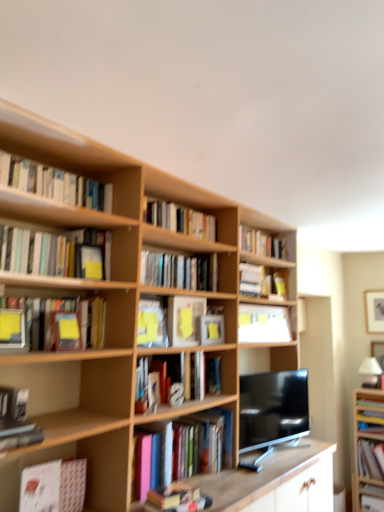
Identify the location of matte pink book at lower left, which is counted as the 4th book, starting from the bottom. (53, 487).

In order to click on yellow matte paper at upper left, which appears as the 2th paperback book when viewed from the front in this screenshot , I will do `click(91, 262)`.

What do you see at coordinates (368, 460) in the screenshot? I see `hardcover book at lower right, the 2th book ordered from the bottom` at bounding box center [368, 460].

The width and height of the screenshot is (384, 512). Identify the location of matte yellow book at left, the 7th book from the top. (64, 324).

Where is `hardcover books at upper left, which is the thirteenth book in bottom-to-top order`? The height and width of the screenshot is (512, 384). hardcover books at upper left, which is the thirteenth book in bottom-to-top order is located at coordinates (54, 183).

Is matte pink book at lower left, the tenth book viewed from the top, looking in the opposite direction of hardcover book at center, which ranks as the 6th book in top-to-bottom order?

No, matte pink book at lower left, the tenth book viewed from the top, is not facing the opposite direction of hardcover book at center, which ranks as the 6th book in top-to-bottom order.

Between matte pink book at lower left, the tenth book viewed from the top, and hardcover book at center, the 8th book in the bottom-to-top sequence, which one appears on the left side from the viewer's perspective?

From the viewer's perspective, matte pink book at lower left, the tenth book viewed from the top, appears more on the left side.

The height and width of the screenshot is (512, 384). I want to click on the 7th book behind when counting from the matte pink book at lower left, which is counted as the 4th book, starting from the bottom, so click(260, 282).

Is matte pink book at lower left, the tenth book viewed from the top, next to hardcover book at center, which ranks as the 6th book in top-to-bottom order, and touching it?

matte pink book at lower left, the tenth book viewed from the top, is not next to hardcover book at center, which ranks as the 6th book in top-to-bottom order, and they're not touching.

Who is bigger, hardcover book at center, which is the 11th book in top-to-bottom order, or matte yellow book at upper left, which appears as the 4th book when viewed from the top?

matte yellow book at upper left, which appears as the 4th book when viewed from the top.

Visually, is hardcover book at center, which is the third book in bottom-to-top order, positioned to the left or to the right of matte yellow book at upper left, which appears as the 4th book when viewed from the top?

hardcover book at center, which is the third book in bottom-to-top order, is to the right of matte yellow book at upper left, which appears as the 4th book when viewed from the top.

Is hardcover book at center, which is the 11th book in top-to-bottom order, closer to camera compared to matte yellow book at upper left, which appears as the 4th book when viewed from the top?

No, hardcover book at center, which is the 11th book in top-to-bottom order, is further to the viewer.

Considering the positions of point (76, 260) and point (262, 234), is point (76, 260) closer or farther from the camera than point (262, 234)?

Clearly, point (76, 260) is closer to the camera than point (262, 234).

Could you tell me if matte yellow book at upper left, which appears as the 4th book when viewed from the top, is facing wooden bookshelf at upper center, the 3th book when ordered from top to bottom?

No, matte yellow book at upper left, which appears as the 4th book when viewed from the top, is not facing towards wooden bookshelf at upper center, the 3th book when ordered from top to bottom.

Can you tell me how much matte yellow book at upper left, the 10th book when ordered from bottom to top, and wooden bookshelf at upper center, which appears as the 11th book when ordered from the bottom, differ in facing direction?

matte yellow book at upper left, the 10th book when ordered from bottom to top, and wooden bookshelf at upper center, which appears as the 11th book when ordered from the bottom, are facing 3.08 degrees away from each other.

From a real-world perspective, is matte yellow book at upper left, the 10th book when ordered from bottom to top, located beneath wooden bookshelf at upper center, the 3th book when ordered from top to bottom?

Yes, from a real-world perspective, matte yellow book at upper left, the 10th book when ordered from bottom to top, is below wooden bookshelf at upper center, the 3th book when ordered from top to bottom.

Who is taller, hardcover book at lower right, the 2th book ordered from the bottom, or yellow matte paper at upper left, which is counted as the 2th paperback book, starting from the left?

With more height is hardcover book at lower right, the 2th book ordered from the bottom.

From the image's perspective, relative to yellow matte paper at upper left, which ranks as the 3th paperback book in right-to-left order, is hardcover book at lower right, the twelfth book positioned from the top, above or below?

Based on their image positions, hardcover book at lower right, the twelfth book positioned from the top, is located beneath yellow matte paper at upper left, which ranks as the 3th paperback book in right-to-left order.

Is yellow matte paper at upper left, which is counted as the 2th paperback book, starting from the left, at the back of hardcover book at lower right, the twelfth book positioned from the top?

That's not correct — hardcover book at lower right, the twelfth book positioned from the top, is not looking away from yellow matte paper at upper left, which is counted as the 2th paperback book, starting from the left.

Can you confirm if hardcover book at lower right, the 2th book ordered from the bottom, is bigger than yellow matte paper at upper left, which ranks as the 3th paperback book in right-to-left order?

Indeed, hardcover book at lower right, the 2th book ordered from the bottom, has a larger size compared to yellow matte paper at upper left, which ranks as the 3th paperback book in right-to-left order.

Considering the relative positions of matte pink book at lower left, which is counted as the 4th book, starting from the bottom, and hardcover books at upper left, placed as the 1th book when sorted from top to bottom, in the image provided, is matte pink book at lower left, which is counted as the 4th book, starting from the bottom, behind hardcover books at upper left, placed as the 1th book when sorted from top to bottom,?

No, matte pink book at lower left, which is counted as the 4th book, starting from the bottom, is closer to the viewer.

Is matte pink book at lower left, which is counted as the 4th book, starting from the bottom, aimed at hardcover books at upper left, which is the thirteenth book in bottom-to-top order?

No.

From their relative heights in the image, would you say matte pink book at lower left, the tenth book viewed from the top, is taller or shorter than hardcover books at upper left, placed as the 1th book when sorted from top to bottom?

Considering their sizes, matte pink book at lower left, the tenth book viewed from the top, has more height than hardcover books at upper left, placed as the 1th book when sorted from top to bottom.

How different are the orientations of yellow matte paper at upper left, which is counted as the 2th paperback book, starting from the left, and matte yellow book at left, the 7th book when ordered from bottom to top, in degrees?

0.00183 degrees separate the facing orientations of yellow matte paper at upper left, which is counted as the 2th paperback book, starting from the left, and matte yellow book at left, the 7th book when ordered from bottom to top.

Which of these two, yellow matte paper at upper left, which appears as the 2th paperback book when viewed from the front, or matte yellow book at left, the 7th book when ordered from bottom to top, stands taller?

Standing taller between the two is matte yellow book at left, the 7th book when ordered from bottom to top.

From the image's perspective, which is below, yellow matte paper at upper left, which ranks as the 3th paperback book in right-to-left order, or matte yellow book at left, the 7th book from the top?

matte yellow book at left, the 7th book from the top.

From a real-world perspective, is yellow matte paper at upper left, which appears as the 2th paperback book when viewed from the front, physically above matte yellow book at left, the 7th book when ordered from bottom to top?

Yes.

From a real-world perspective, is matte yellow paperback book at left, positioned as the 1th paperback book in left-to-right order, beneath yellow matte paper at center, the 1th paperback book viewed from the back?

No, from a real-world perspective, matte yellow paperback book at left, positioned as the 1th paperback book in left-to-right order, is not below yellow matte paper at center, the 1th paperback book viewed from the back.

Does matte yellow paperback book at left, the 4th paperback book in the back-to-front sequence, appear on the left side of yellow matte paper at center, the first paperback book positioned from the right?

Yes, matte yellow paperback book at left, the 4th paperback book in the back-to-front sequence, is to the left of yellow matte paper at center, the first paperback book positioned from the right.

From the picture: Is matte yellow paperback book at left, positioned as the 1th paperback book in left-to-right order, far away from yellow matte paper at center, the 4th paperback book in the front-to-back sequence?

matte yellow paperback book at left, positioned as the 1th paperback book in left-to-right order, is actually quite close to yellow matte paper at center, the 4th paperback book in the front-to-back sequence.

From the image's perspective, who appears lower, matte yellow paperback book at left, the 4th paperback book in the back-to-front sequence, or yellow matte paper at center, the first paperback book positioned from the right?

yellow matte paper at center, the first paperback book positioned from the right, appears lower in the image.

There is a matte pink book at lower left, the tenth book viewed from the top. At what (x,y) coordinates should I click in order to perform the action: click on the 6th book above it (from a real-world perspective). Please return your answer as a coordinate pair (x, y). The image size is (384, 512). Looking at the image, I should click on (260, 282).

Locate an element on the screen. This screenshot has height=512, width=384. the 7th book positioned above the hardcover book at center, which is the third book in bottom-to-top order (from the image's perspective) is located at coordinates (54, 254).

Estimate the real-world distances between objects in this image. Which object is further from hardcover book at lower right, the 2th book ordered from the bottom, hardcover books at center, which ranks as the fifth book in top-to-bottom order, or hardcover books at upper left, which is the thirteenth book in bottom-to-top order?

hardcover books at upper left, which is the thirteenth book in bottom-to-top order, is positioned further to the anchor hardcover book at lower right, the 2th book ordered from the bottom.

Based on the photo, estimate the real-world distances between objects in this image. Which object is closer to matte yellow book at upper left, the 10th book when ordered from bottom to top, yellow matte paper at center, which ranks as the fourth paperback book in left-to-right order, or yellow matte paper at upper left, which is the third paperback book in back-to-front order?

Among the two, yellow matte paper at upper left, which is the third paperback book in back-to-front order, is located nearer to matte yellow book at upper left, the 10th book when ordered from bottom to top.

Looking at the image, which one is located closer to hardcover book at center, the 8th book in the bottom-to-top sequence, wooden bookcase at right, which is the second bookcase from left to right, or wooden bookshelf at upper center, which appears as the 11th book when ordered from the bottom?

wooden bookshelf at upper center, which appears as the 11th book when ordered from the bottom.

Looking at the image, which one is located closer to yellow matte paper at center, marked as the third paperback book in a left-to-right arrangement, matte black tv at center or white matte bookshelf at upper center, the eighth book in the top-to-bottom sequence?

The object closer to yellow matte paper at center, marked as the third paperback book in a left-to-right arrangement, is white matte bookshelf at upper center, the eighth book in the top-to-bottom sequence.

Estimate the real-world distances between objects in this image. Which object is closer to wooden bookcase at right, which is counted as the 2th bookcase, starting from the top, matte yellow book at upper left, which appears as the 4th book when viewed from the top, or yellow matte paper at center, which ranks as the fourth paperback book in left-to-right order?

yellow matte paper at center, which ranks as the fourth paperback book in left-to-right order.

Consider the image. Estimate the real-world distances between objects in this image. Which object is closer to hardcover book at lower right, the 2th book ordered from the bottom, light wood bookcase at upper left, arranged as the first bookcase when viewed from the left, or hardcover book at center, the 8th book in the bottom-to-top sequence?

hardcover book at center, the 8th book in the bottom-to-top sequence.

Which object lies nearer to the anchor point matte yellow book at upper left, the 10th book when ordered from bottom to top, matte yellow paperback book at left, which is the fourth paperback book in right-to-left order, or hardcover book at lower right, the 2th book ordered from the bottom?

Based on the image, matte yellow paperback book at left, which is the fourth paperback book in right-to-left order, appears to be nearer to matte yellow book at upper left, the 10th book when ordered from bottom to top.

From the image, which object appears to be nearer to matte yellow book at upper left, which appears as the 4th book when viewed from the top, metallic gray hardcover book at lower left, the ninth book positioned from the top, or white matte bookshelf at upper center, the eighth book in the top-to-bottom sequence?

metallic gray hardcover book at lower left, the ninth book positioned from the top, is closer to matte yellow book at upper left, which appears as the 4th book when viewed from the top.

Find the location of a particular element. Image resolution: width=384 pixels, height=512 pixels. bookcase that lies between yellow matte paper at center, which ranks as the fourth paperback book in left-to-right order, and matte white book at lower right, acting as the 1th book starting from the bottom, from top to bottom is located at coordinates (368, 450).

Locate an element on the screen. This screenshot has height=512, width=384. television between hardcover books at upper left, placed as the 1th book when sorted from top to bottom, and matte white book at lower right, acting as the 1th book starting from the bottom, vertically is located at coordinates (273, 408).

Find the location of a particular element. The height and width of the screenshot is (512, 384). paperback book between yellow matte paper at center, the third paperback book positioned from the front, and matte black tv at center, in the vertical direction is located at coordinates (212, 329).

The image size is (384, 512). I want to click on paperback book between yellow matte paper at upper left, which is counted as the 2th paperback book, starting from the left, and yellow matte paper at center, the 1th paperback book viewed from the back, in the horizontal direction, so click(185, 320).